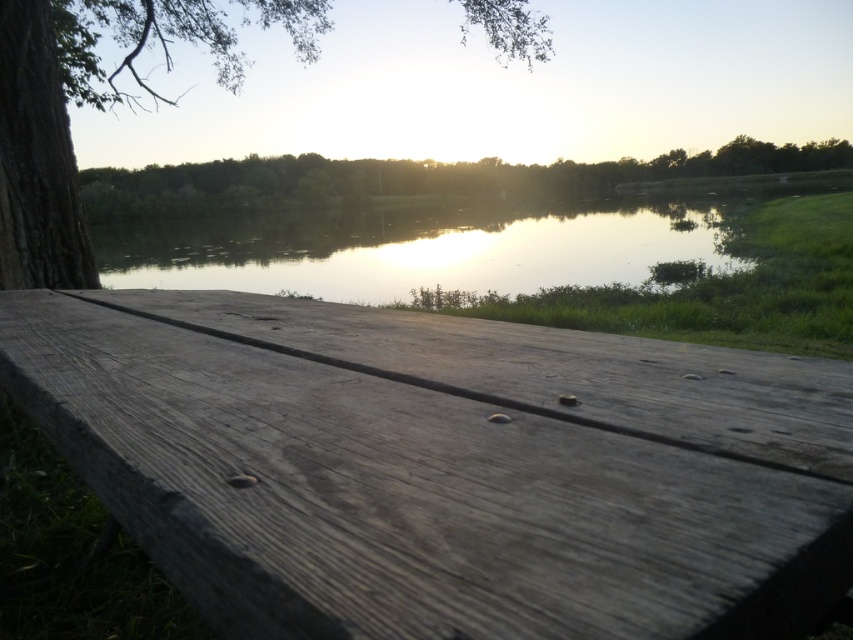
Can you confirm if weathered wood picnic table at center is positioned below green leafy tree at upper center?

Indeed, weathered wood picnic table at center is positioned under green leafy tree at upper center.

Which is more to the right, weathered wood picnic table at center or green leafy tree at upper center?

green leafy tree at upper center is more to the right.

Which is behind, point (672, 596) or point (714, 156)?

The point (714, 156) is behind.

Locate an element on the screen. This screenshot has width=853, height=640. weathered wood picnic table at center is located at coordinates (437, 483).

Consider the image. Who is taller, glistening water at center or green leafy tree at upper center?

green leafy tree at upper center is taller.

Does point (252, 282) lie behind point (254, 160)?

No, it is not.

At what (x,y) coordinates should I click in order to perform the action: click on glistening water at center. Please return your answer as a coordinate pair (x, y). Looking at the image, I should click on (415, 250).

Which is in front, point (590, 284) or point (68, 216)?

Positioned in front is point (68, 216).

Which of these two, glistening water at center or smooth brown tree trunk at left, stands taller?

smooth brown tree trunk at left is taller.

Does point (428, 257) lie behind point (495, 44)?

Yes, point (428, 257) is behind point (495, 44).

Locate an element on the screen. Image resolution: width=853 pixels, height=640 pixels. glistening water at center is located at coordinates (415, 250).